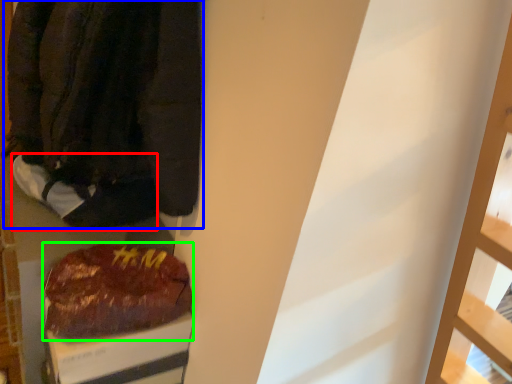
Question: Which is farther away from footwear (highlighted by a red box)? jacket (highlighted by a blue box) or food (highlighted by a green box)?

Choices:
 (A) jacket
 (B) food

Answer: (B)